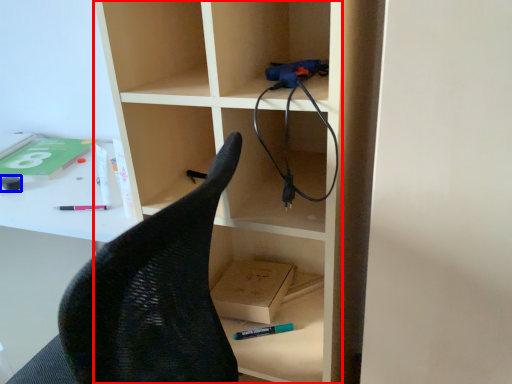
Question: Which object appears farthest to the camera in this image, bookshelf (highlighted by a red box) or stationery (highlighted by a blue box)?

Choices:
 (A) bookshelf
 (B) stationery

Answer: (B)